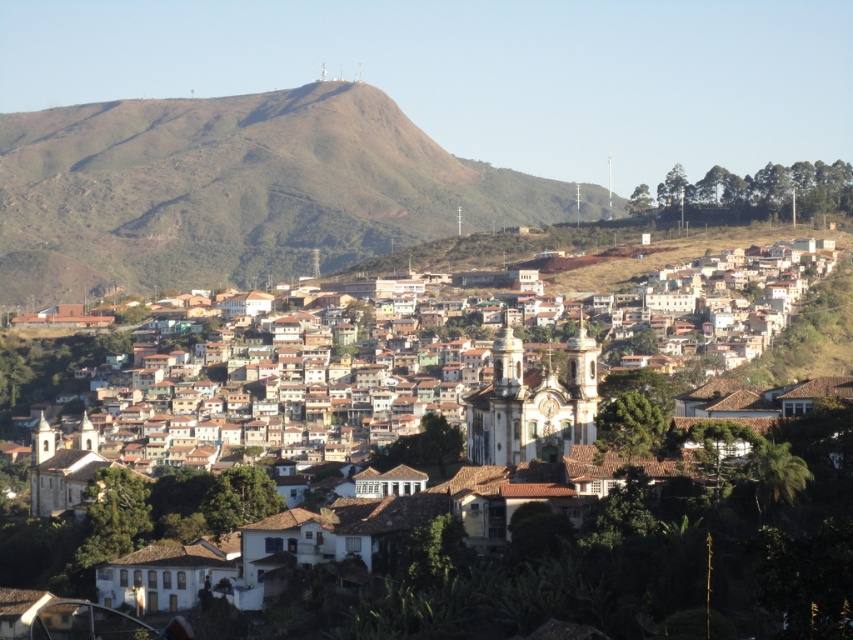
Describe the element at coordinates (602, 541) in the screenshot. This screenshot has height=640, width=853. I see `brown clay roof tiles at center` at that location.

Who is positioned more to the left, brown clay roof tiles at center or green grassy hill at upper center?

green grassy hill at upper center is more to the left.

Is point (561, 476) farther from camera compared to point (358, 100)?

No, (561, 476) is closer to viewer.

Locate an element on the screen. brown clay roof tiles at center is located at coordinates (602, 541).